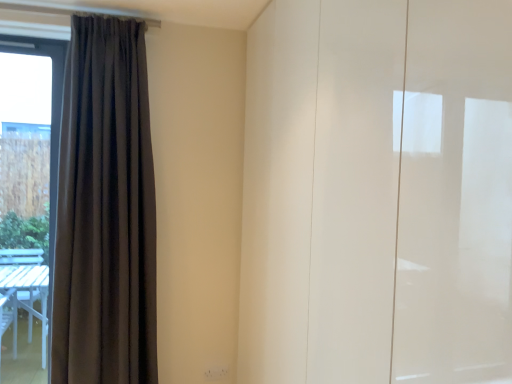
Question: Is white glossy cabinet at right to the left or to the right of dark grey fabric curtain at left in the image?

Choices:
 (A) left
 (B) right

Answer: (B)

Question: In terms of height, does white glossy cabinet at right look taller or shorter compared to dark grey fabric curtain at left?

Choices:
 (A) tall
 (B) short

Answer: (A)

Question: Considering the positions of white glossy cabinet at right and dark grey fabric curtain at left in the image, is white glossy cabinet at right bigger or smaller than dark grey fabric curtain at left?

Choices:
 (A) big
 (B) small

Answer: (A)

Question: From a real-world perspective, is dark grey fabric curtain at left above or below white glossy cabinet at right?

Choices:
 (A) above
 (B) below

Answer: (A)

Question: Relative to white glossy cabinet at right, is dark grey fabric curtain at left in front or behind?

Choices:
 (A) front
 (B) behind

Answer: (B)

Question: Based on their sizes in the image, would you say dark grey fabric curtain at left is bigger or smaller than white glossy cabinet at right?

Choices:
 (A) small
 (B) big

Answer: (A)

Question: Is dark grey fabric curtain at left situated inside white glossy cabinet at right or outside?

Choices:
 (A) inside
 (B) outside

Answer: (B)